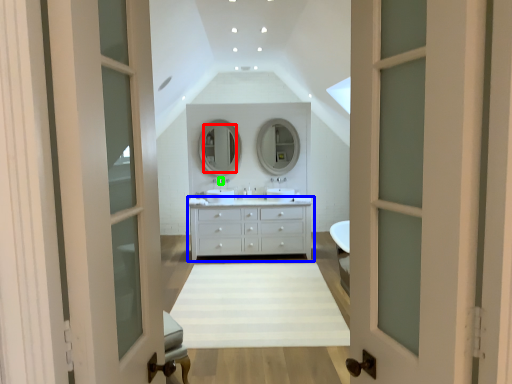
Question: Estimate the real-world distances between objects in this image. Which object is closer to mirror (highlighted by a red box), chest of drawers (highlighted by a blue box) or faucet (highlighted by a green box)?

Choices:
 (A) chest of drawers
 (B) faucet

Answer: (B)